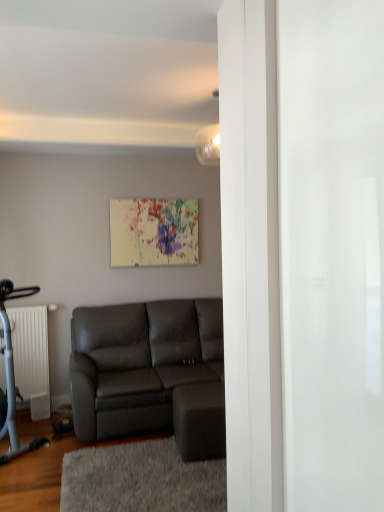
Question: Is matte white light fixture at upper center aimed at white matte radiator at left?

Choices:
 (A) no
 (B) yes

Answer: (A)

Question: Considering the relative sizes of matte white light fixture at upper center and white matte radiator at left in the image provided, is matte white light fixture at upper center shorter than white matte radiator at left?

Choices:
 (A) yes
 (B) no

Answer: (A)

Question: Is matte white light fixture at upper center turned away from white matte radiator at left?

Choices:
 (A) yes
 (B) no

Answer: (B)

Question: Can you confirm if matte white light fixture at upper center is thinner than white matte radiator at left?

Choices:
 (A) no
 (B) yes

Answer: (B)

Question: Considering the relative sizes of matte white light fixture at upper center and white matte radiator at left in the image provided, is matte white light fixture at upper center bigger than white matte radiator at left?

Choices:
 (A) yes
 (B) no

Answer: (B)

Question: Is matte white light fixture at upper center in front of white matte radiator at left?

Choices:
 (A) yes
 (B) no

Answer: (A)

Question: Could matte gray couch at center be considered to be inside white matte radiator at left?

Choices:
 (A) yes
 (B) no

Answer: (B)

Question: Does white matte radiator at left turn towards matte gray couch at center?

Choices:
 (A) no
 (B) yes

Answer: (A)

Question: Is the position of white matte radiator at left more distant than that of matte gray couch at center?

Choices:
 (A) no
 (B) yes

Answer: (B)

Question: Is white matte radiator at left wider than matte gray couch at center?

Choices:
 (A) no
 (B) yes

Answer: (A)

Question: Is the position of white matte radiator at left less distant than that of matte gray couch at center?

Choices:
 (A) yes
 (B) no

Answer: (B)

Question: Are white matte radiator at left and matte gray couch at center far apart?

Choices:
 (A) no
 (B) yes

Answer: (A)

Question: Is gray textured rug at lower center facing away from matte white light fixture at upper center?

Choices:
 (A) no
 (B) yes

Answer: (A)